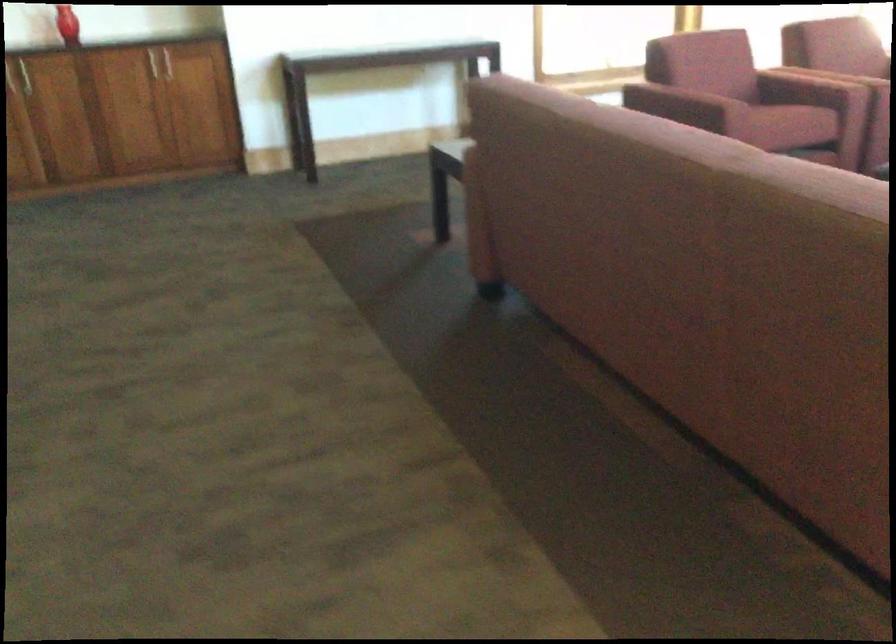
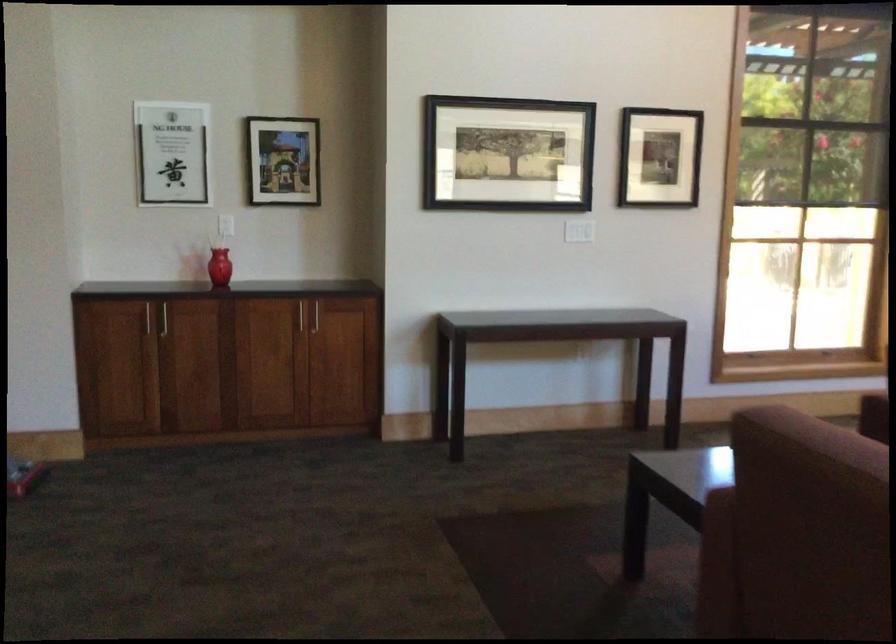
Question: The images are taken continuously from a first-person perspective. In which direction is your viewpoint rotating?

Choices:
 (A) Left
 (B) Right
 (C) Up
 (D) Down

Answer: (C)